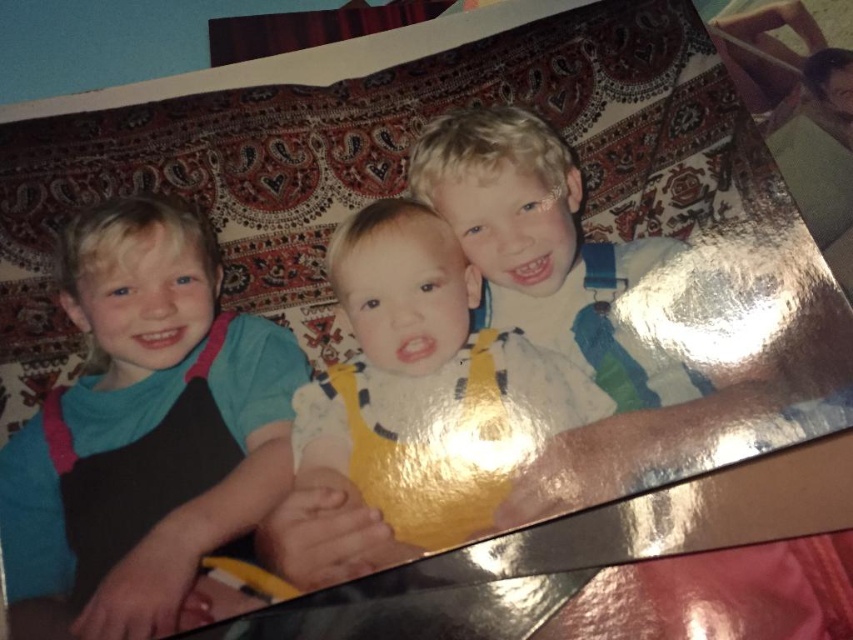
You are a tailor who needs to determine which clothing item requires more fabric to alter. You see the blue cotton shirt at left and the matte blue overalls at center. Which one would need more fabric for alterations?

The blue cotton shirt at left is larger in size than the matte blue overalls at center, so it would require more fabric for alterations.